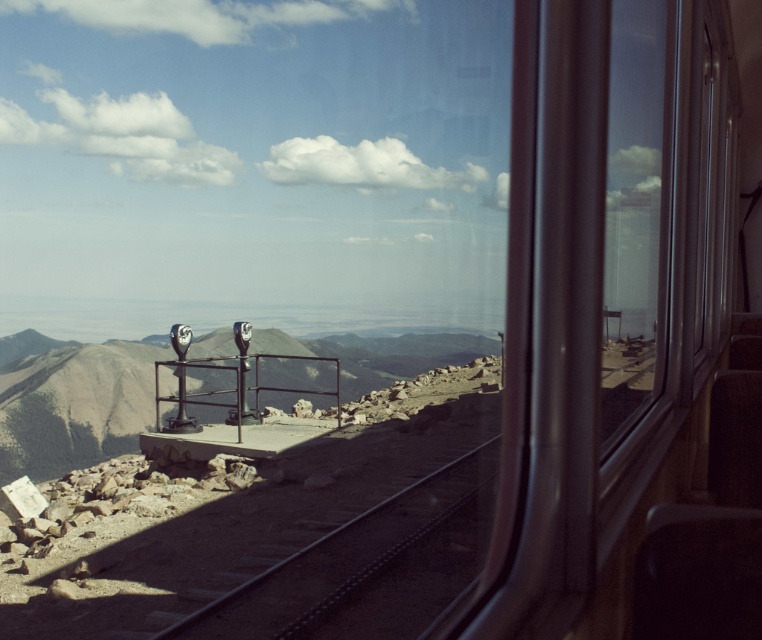
Looking at this image, does dark brown gravel train track at center appear on the right side of transparent glass window at right?

No, dark brown gravel train track at center is not to the right of transparent glass window at right.

Does dark brown gravel train track at center have a greater height compared to transparent glass window at right?

No.

This screenshot has width=762, height=640. I want to click on dark brown gravel train track at center, so click(x=367, y=566).

Locate an element on the screen. The width and height of the screenshot is (762, 640). dark brown gravel train track at center is located at coordinates (367, 566).